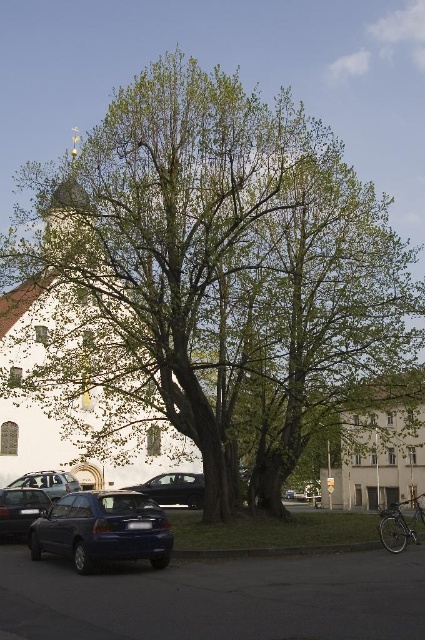
You are standing in the middle of the image and want to walk towards the white stone church at center. In which direction should you move?

Since the white stone church at center is located at point 0.619 on the x axis and 0.167 on the y axis, you should move to the right and slightly downward to reach it.

Based on the photo, you are standing in the urban scene and want to place a small bench between the two points, point (189, 486) and point (71, 483). Which point should the bench be closer to in order to be nearer to the large tree?

The bench should be closer to point (189, 486) because it is nearer to the large tree than point (71, 483).

You are a city planner analyzing the urban layout. You observe the white stone church at center and the white concrete building at center in the scene. Which of these two structures has a smaller footprint in terms of physical size?

The white stone church at center has a smaller size compared to the white concrete building at center, so it has a smaller footprint.